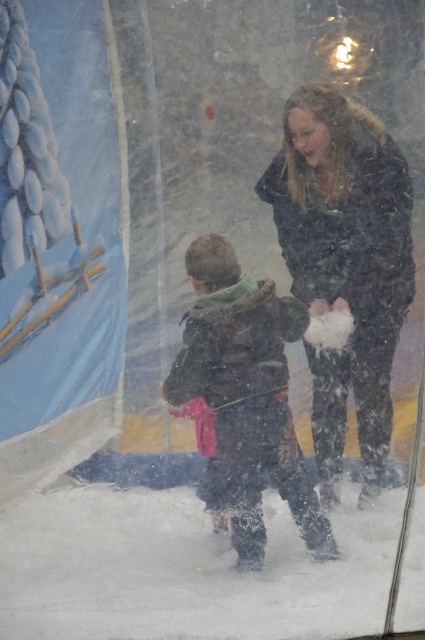
Question: Which point is farther to the camera?

Choices:
 (A) click(x=393, y=339)
 (B) click(x=183, y=369)

Answer: (A)

Question: Where is dark brown jacket at center located in relation to dark green fuzzy jacket at center in the image?

Choices:
 (A) above
 (B) below

Answer: (A)

Question: In this image, where is dark brown jacket at center located relative to dark green fuzzy jacket at center?

Choices:
 (A) left
 (B) right

Answer: (B)

Question: From the image, what is the correct spatial relationship of dark brown jacket at center in relation to dark green fuzzy jacket at center?

Choices:
 (A) above
 (B) below

Answer: (A)

Question: Among these objects, which one is nearest to the camera?

Choices:
 (A) dark green fuzzy jacket at center
 (B) dark brown jacket at center

Answer: (B)

Question: Among these objects, which one is nearest to the camera?

Choices:
 (A) dark green fuzzy jacket at center
 (B) dark brown jacket at center

Answer: (B)